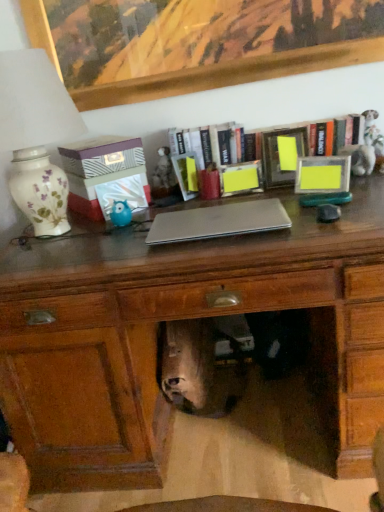
Question: Is matte wooden desk at center at the back of matte yellow picture frame at right, the second picture frame when ordered from left to right?

Choices:
 (A) yes
 (B) no

Answer: (B)

Question: Would you say matte yellow picture frame at right, the second picture frame when ordered from left to right, is outside matte wooden desk at center?

Choices:
 (A) no
 (B) yes

Answer: (B)

Question: Would you say matte yellow picture frame at right, which is the first picture frame in right-to-left order, contains matte wooden desk at center?

Choices:
 (A) yes
 (B) no

Answer: (B)

Question: Does matte yellow picture frame at right, the second picture frame when ordered from left to right, have a greater height compared to matte wooden desk at center?

Choices:
 (A) no
 (B) yes

Answer: (A)

Question: Considering the relative sizes of matte yellow picture frame at right, which is the first picture frame in right-to-left order, and matte wooden desk at center in the image provided, is matte yellow picture frame at right, which is the first picture frame in right-to-left order, wider than matte wooden desk at center?

Choices:
 (A) yes
 (B) no

Answer: (B)

Question: Would you say white floral ceramic lamp at left is to the left or to the right of silver metallic laptop at center in the picture?

Choices:
 (A) left
 (B) right

Answer: (A)

Question: Is white floral ceramic lamp at left inside or outside of silver metallic laptop at center?

Choices:
 (A) outside
 (B) inside

Answer: (A)

Question: Is white floral ceramic lamp at left in front of or behind silver metallic laptop at center in the image?

Choices:
 (A) front
 (B) behind

Answer: (A)

Question: Considering the positions of white floral ceramic lamp at left and silver metallic laptop at center in the image, is white floral ceramic lamp at left taller or shorter than silver metallic laptop at center?

Choices:
 (A) short
 (B) tall

Answer: (B)

Question: From the image's perspective, is matte wooden desk at center located above or below shiny silver skull at center?

Choices:
 (A) below
 (B) above

Answer: (B)

Question: Considering the relative positions of matte wooden desk at center and shiny silver skull at center in the image provided, is matte wooden desk at center to the left or to the right of shiny silver skull at center?

Choices:
 (A) right
 (B) left

Answer: (A)

Question: Considering the positions of matte wooden desk at center and shiny silver skull at center in the image, is matte wooden desk at center bigger or smaller than shiny silver skull at center?

Choices:
 (A) big
 (B) small

Answer: (A)

Question: Which is correct: matte wooden desk at center is inside shiny silver skull at center, or outside of it?

Choices:
 (A) outside
 (B) inside

Answer: (A)

Question: Does point (304, 134) appear closer or farther from the camera than point (114, 222)?

Choices:
 (A) farther
 (B) closer

Answer: (A)

Question: Is wooden bookshelf at upper center inside or outside of matte blue plastic owl at center-left?

Choices:
 (A) outside
 (B) inside

Answer: (A)